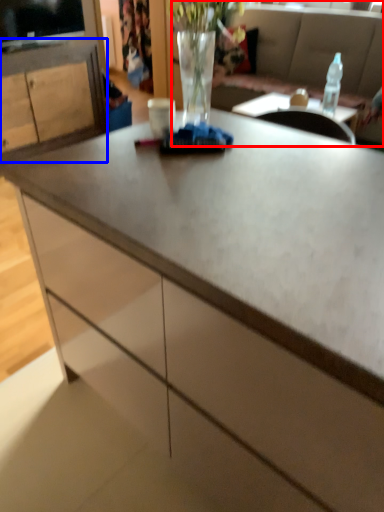
Question: Which object appears farthest to the camera in this image, studio couch (highlighted by a red box) or cabinetry (highlighted by a blue box)?

Choices:
 (A) studio couch
 (B) cabinetry

Answer: (B)